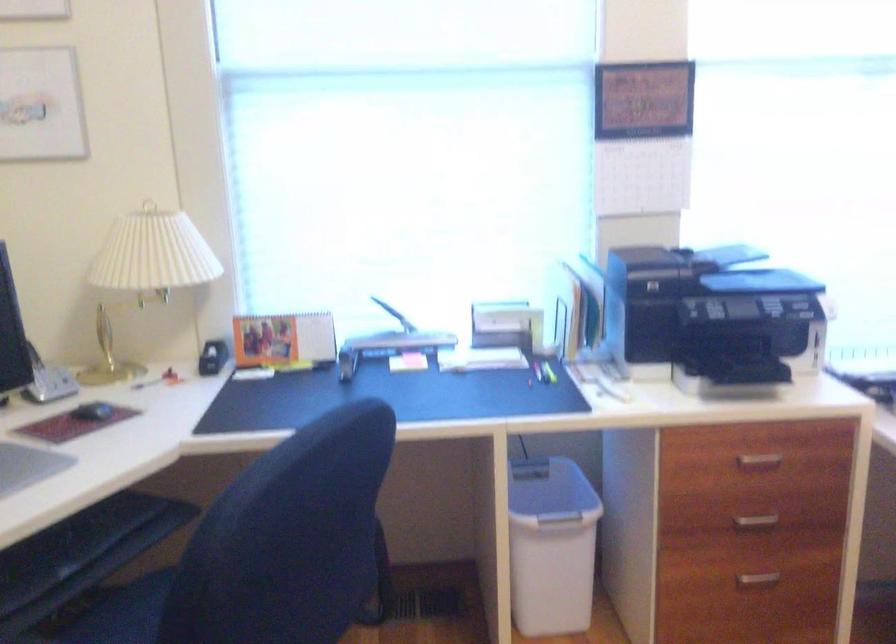
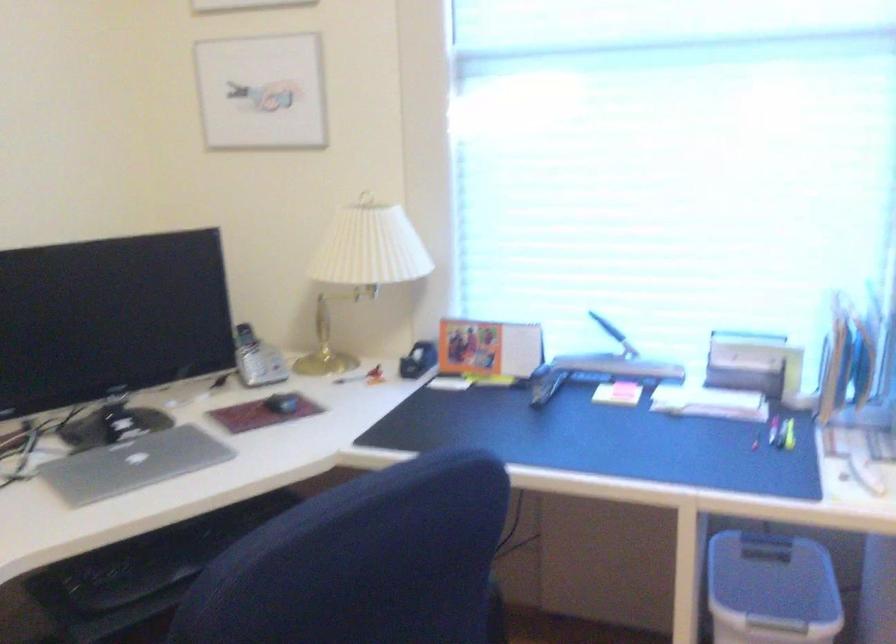
In the second image, find the point that corresponds to (539,504) in the first image.

(771, 589)